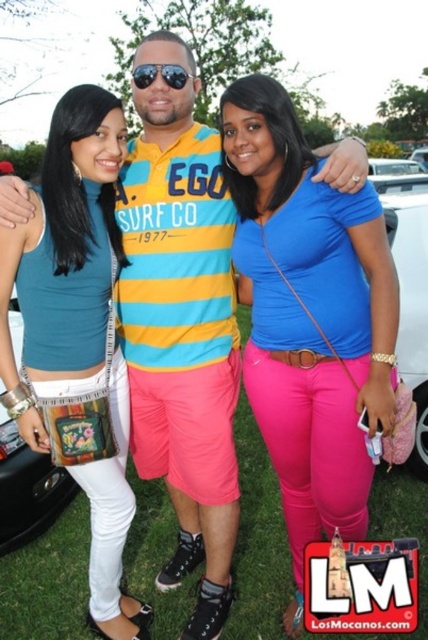
Can you confirm if blue matte shirt at center is positioned to the right of sunglasses at center?

Correct, you'll find blue matte shirt at center to the right of sunglasses at center.

Who is more distant from viewer, (287, 460) or (174, 68)?

The point (287, 460) is behind.

Identify the location of blue matte shirt at center. (309, 317).

Which is behind, point (246, 353) or point (56, 122)?

The point (246, 353) is more distant.

Does blue matte shirt at center lie behind teal fabric tank top at center?

No, blue matte shirt at center is closer to the viewer.

The height and width of the screenshot is (640, 428). In order to click on blue matte shirt at center in this screenshot , I will do `click(309, 317)`.

Is teal fabric tank top at center taller than sunglasses at center?

Correct, teal fabric tank top at center is much taller as sunglasses at center.

Who is lower down, teal fabric tank top at center or sunglasses at center?

Positioned lower is teal fabric tank top at center.

Locate an element on the screen. teal fabric tank top at center is located at coordinates (77, 337).

In order to click on teal fabric tank top at center in this screenshot , I will do `click(77, 337)`.